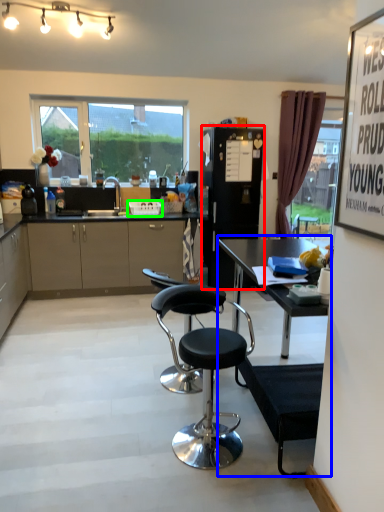
Question: Based on their relative distances, which object is nearer to appliance (highlighted by a red box)? Choose from table (highlighted by a blue box) and picnic basket (highlighted by a green box).

Choices:
 (A) table
 (B) picnic basket

Answer: (B)